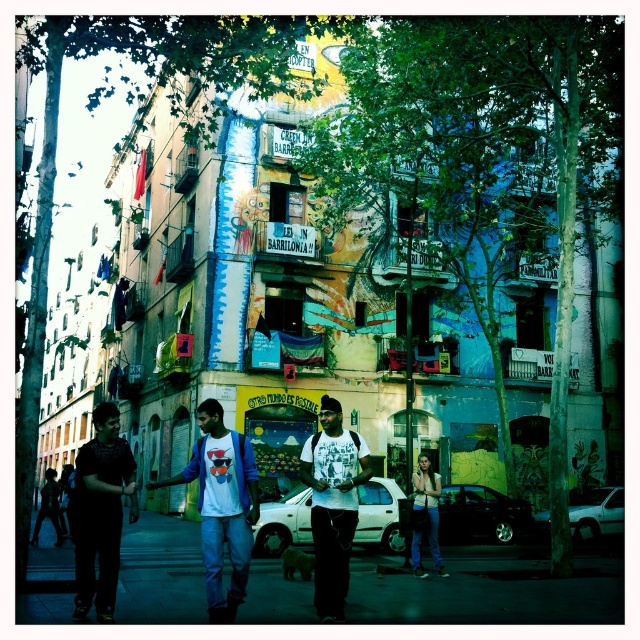
From the picture: Between dark gray shirt at left and white matte t-shirt at center, which one appears on the left side from the viewer's perspective?

dark gray shirt at left

Is point (88, 598) closer to camera compared to point (333, 477)?

Yes, point (88, 598) is closer to viewer.

Where is `dark gray shirt at left`? This screenshot has width=640, height=640. dark gray shirt at left is located at coordinates (100, 513).

Looking at this image, is dark asphalt pavement at lower center taller than white cotton t-shirt at center?

Incorrect, dark asphalt pavement at lower center's height is not larger of white cotton t-shirt at center's.

Is point (563, 604) closer to viewer compared to point (212, 561)?

That is False.

Who is more forward, [454,568] or [204,564]?

Point [204,564]

Image resolution: width=640 pixels, height=640 pixels. What are the coordinates of `dark asphalt pavement at lower center` in the screenshot? It's located at (488, 589).

Can you confirm if white cotton t-shirt at center is positioned above white matte t-shirt at center?

Incorrect, white cotton t-shirt at center is not positioned above white matte t-shirt at center.

This screenshot has width=640, height=640. I want to click on white cotton t-shirt at center, so click(x=221, y=506).

Where is `white cotton t-shirt at center`? This screenshot has height=640, width=640. white cotton t-shirt at center is located at coordinates (221, 506).

Image resolution: width=640 pixels, height=640 pixels. What are the coordinates of `white cotton t-shirt at center` in the screenshot? It's located at (221, 506).